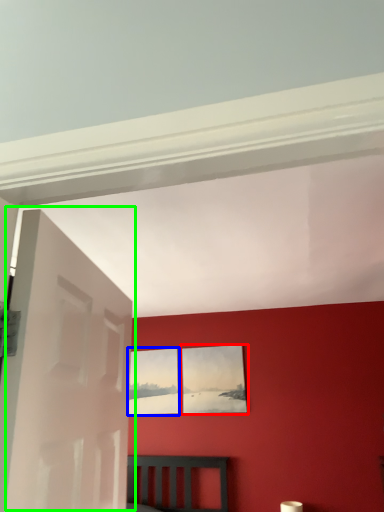
Question: Which object is the farthest from picture frame (highlighted by a red box)? Choose among these: picture frame (highlighted by a blue box) or door (highlighted by a green box).

Choices:
 (A) picture frame
 (B) door

Answer: (B)